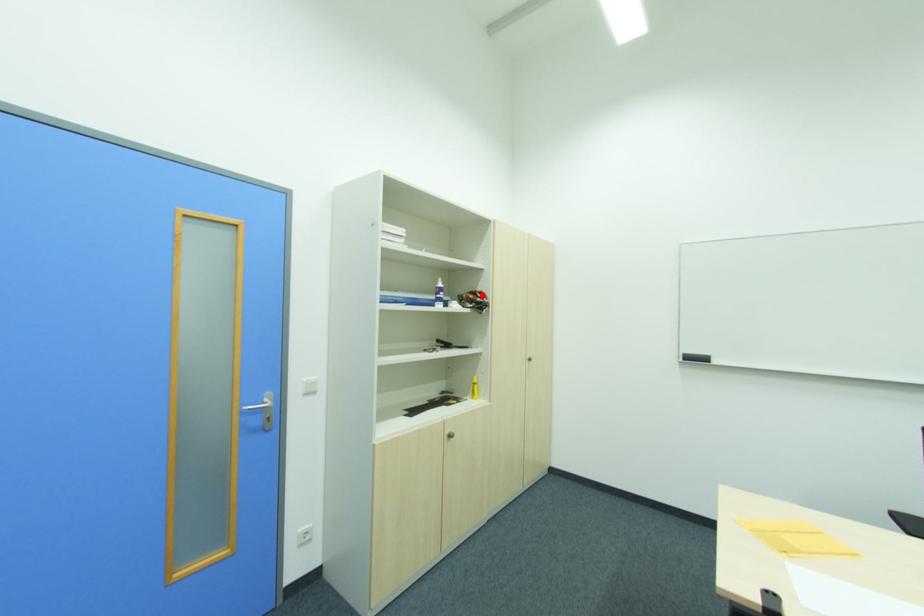
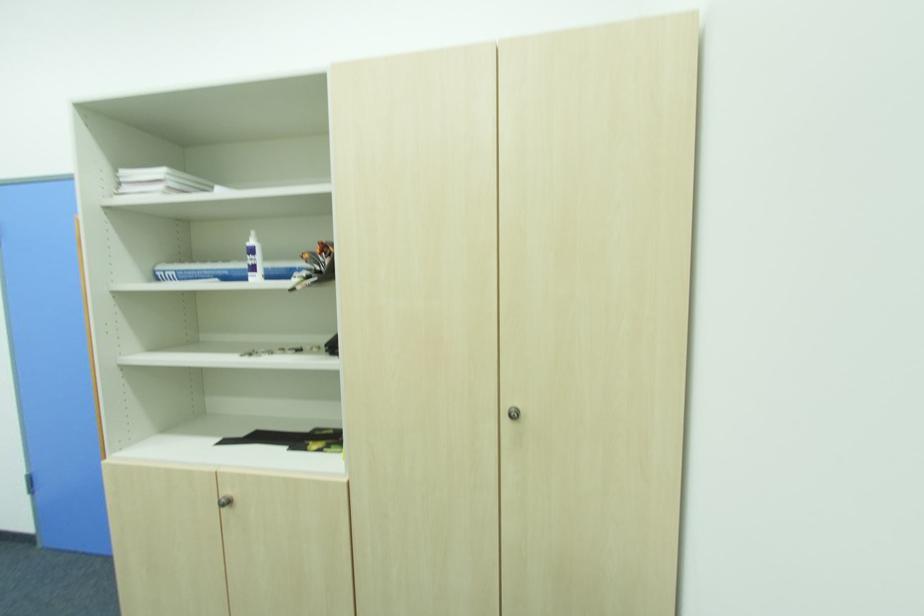
Locate, in the second image, the point that corresponds to the highlighted location in the first image.

(321, 252)